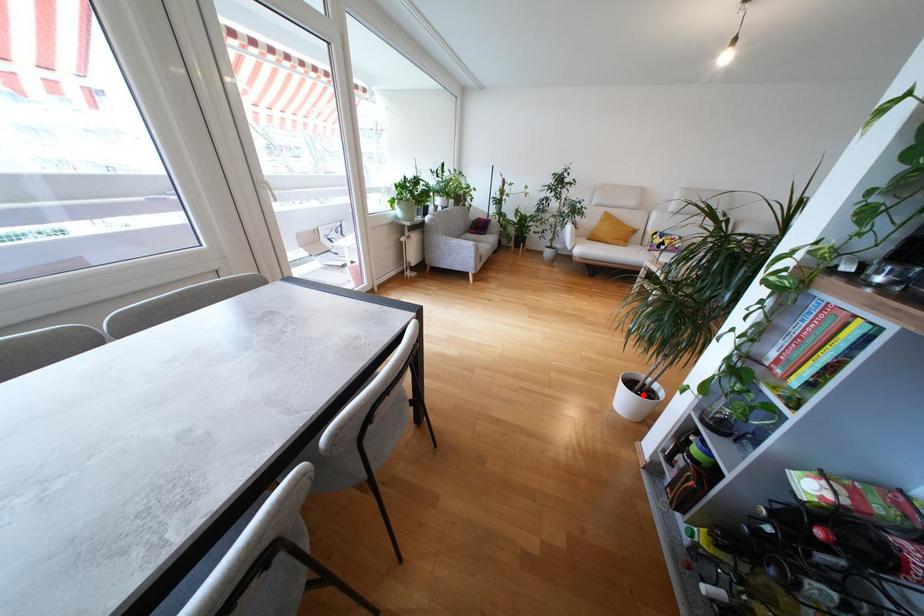
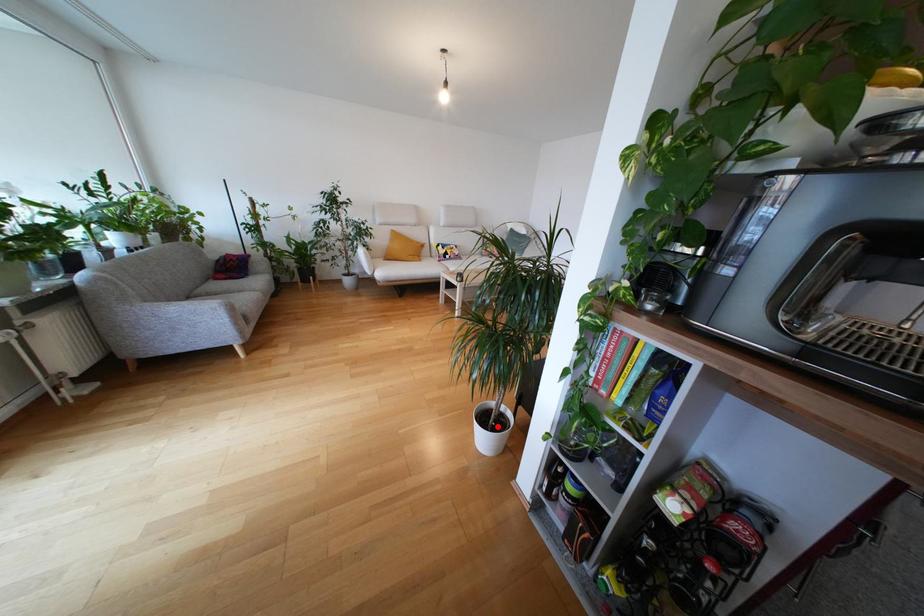
I am providing you with two images of the same scene from different viewpoints. A red point is marked on the first image and another point is marked on the second image. Are the points marked in image1 and image2 representing the same 3D position?

Yes